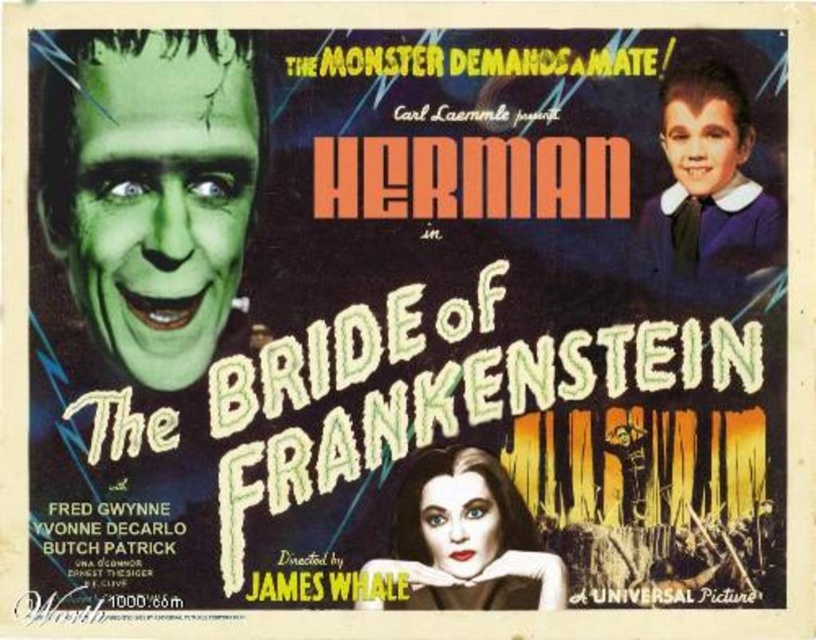
Looking at the vintage movie poster for The Bride of Frankenstein, you notice the green matte face at left and the smooth black hair at center. Which object occupies more horizontal space in the poster?

The green matte face at left occupies more horizontal space than the smooth black hair at center because its width is larger.

You are a movie poster designer reviewing the vintage design of The Bride of Frankenstein. You notice the green matte face at left and the smooth black hair at center. Which object is located higher in the poster?

The green matte face at left is positioned over smooth black hair at center, meaning it is higher in the poster.